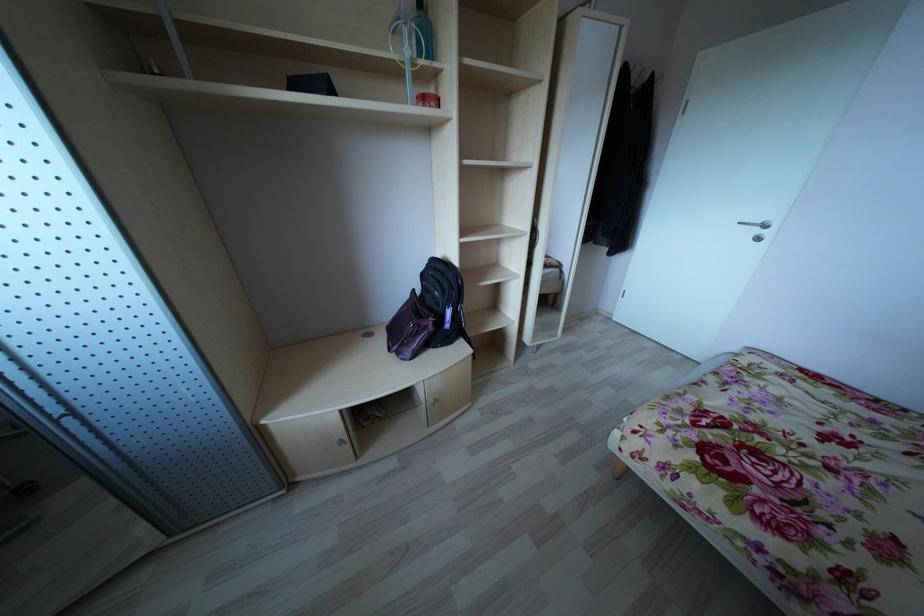
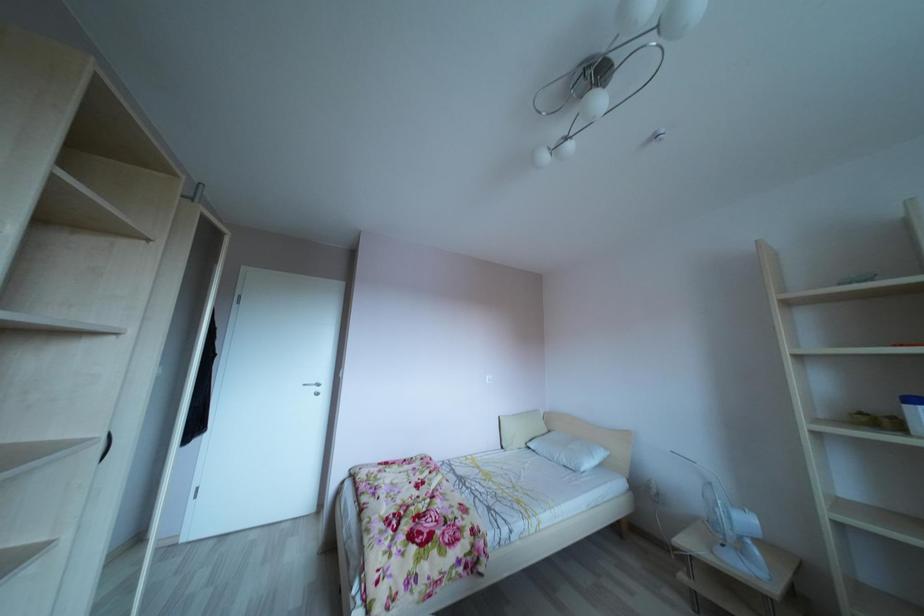
Question: Based on the continuous images, in which direction is the camera rotating? Reply with the corresponding letter.

Choices:
 (A) Left
 (B) Right
 (C) Up
 (D) Down

Answer: (B)